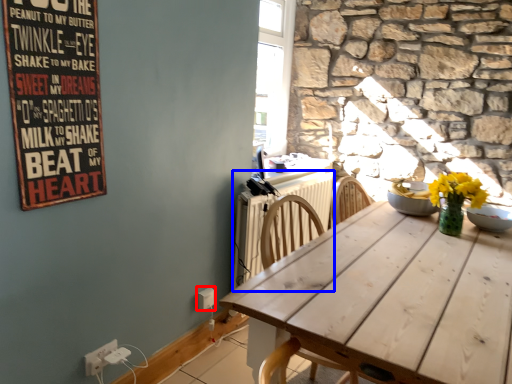
Question: Which of the following is the farthest to the observer, electric outlet (highlighted by a red box) or radiator (highlighted by a blue box)?

Choices:
 (A) electric outlet
 (B) radiator

Answer: (A)